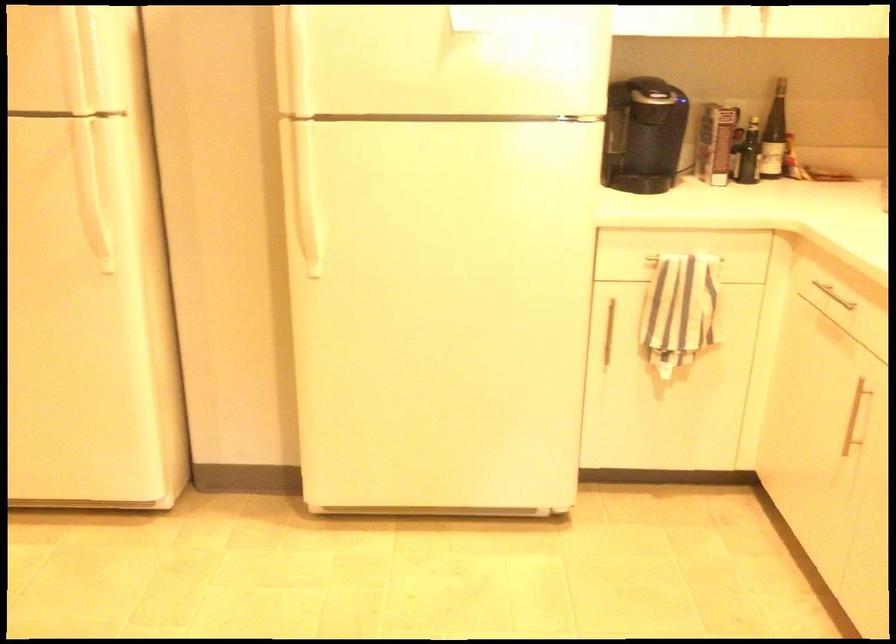
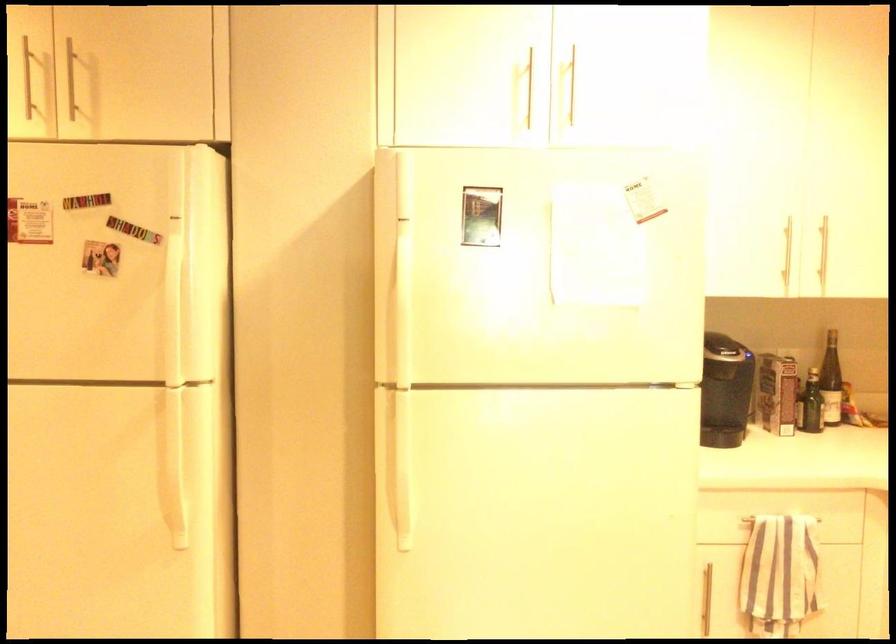
Find the pixel in the second image that matches pixel 85 181 in the first image.

(170, 453)